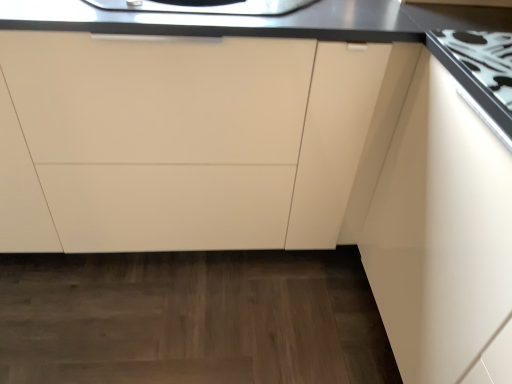
What do you see at coordinates (205, 137) in the screenshot?
I see `matte white cabinet at center` at bounding box center [205, 137].

Where is `matte white cabinet at center`? This screenshot has height=384, width=512. matte white cabinet at center is located at coordinates pyautogui.click(x=205, y=137).

Locate an element on the screen. white glossy gas stove at upper right is located at coordinates (482, 58).

What do you see at coordinates (482, 58) in the screenshot?
I see `white glossy gas stove at upper right` at bounding box center [482, 58].

Measure the distance between white glossy gas stove at upper right and camera.

The depth of white glossy gas stove at upper right is 31.69 inches.

Identify the location of matte white cabinet at center. (205, 137).

Would you say white glossy gas stove at upper right is to the left or to the right of matte white cabinet at center in the picture?

Based on their positions, white glossy gas stove at upper right is located to the right of matte white cabinet at center.

Is white glossy gas stove at upper right in front of or behind matte white cabinet at center in the image?

In the image, white glossy gas stove at upper right appears in front of matte white cabinet at center.

Which point is more forward, (509, 54) or (353, 96)?

The point (509, 54) is in front.

From the image's perspective, is white glossy gas stove at upper right on top of matte white cabinet at center?

Yes, from the image's perspective, white glossy gas stove at upper right is on top of matte white cabinet at center.

From a real-world perspective, is white glossy gas stove at upper right positioned under matte white cabinet at center based on gravity?

No, from a real-world perspective, white glossy gas stove at upper right is not beneath matte white cabinet at center.

Which of these two, white glossy gas stove at upper right or matte white cabinet at center, is wider?

Wider between the two is matte white cabinet at center.

In the scene shown: Can you confirm if white glossy gas stove at upper right is shorter than matte white cabinet at center?

Correct, white glossy gas stove at upper right is not as tall as matte white cabinet at center.

Consider the image. Can you confirm if white glossy gas stove at upper right is smaller than matte white cabinet at center?

Indeed, white glossy gas stove at upper right has a smaller size compared to matte white cabinet at center.

Is matte white cabinet at center inside white glossy gas stove at upper right?

No, white glossy gas stove at upper right does not contain matte white cabinet at center.

Would you say white glossy gas stove at upper right is a long distance from matte white cabinet at center?

No, white glossy gas stove at upper right is not far from matte white cabinet at center.

Is white glossy gas stove at upper right oriented towards matte white cabinet at center?

No, white glossy gas stove at upper right is not aimed at matte white cabinet at center.

I want to click on gas stove located in front of the matte white cabinet at center, so click(482, 58).

Considering the positions of objects matte white cabinet at center and white glossy gas stove at upper right in the image provided, who is more to the left, matte white cabinet at center or white glossy gas stove at upper right?

Positioned to the left is matte white cabinet at center.

Which object is closer to the camera taking this photo, matte white cabinet at center or white glossy gas stove at upper right?

white glossy gas stove at upper right.

Between point (19, 229) and point (511, 53), which one is positioned in front?

Point (511, 53)

Based on the photo, from the image's perspective, between matte white cabinet at center and white glossy gas stove at upper right, who is located below?

matte white cabinet at center.

From a real-world perspective, relative to white glossy gas stove at upper right, is matte white cabinet at center vertically above or below?

Clearly, from a real-world perspective, matte white cabinet at center is below white glossy gas stove at upper right.

In the scene shown: Considering the sizes of objects matte white cabinet at center and white glossy gas stove at upper right in the image provided, who is wider, matte white cabinet at center or white glossy gas stove at upper right?

matte white cabinet at center.

Between matte white cabinet at center and white glossy gas stove at upper right, which one has less height?

white glossy gas stove at upper right.

Who is bigger, matte white cabinet at center or white glossy gas stove at upper right?

With larger size is matte white cabinet at center.

Is matte white cabinet at center outside of white glossy gas stove at upper right?

matte white cabinet at center lies outside white glossy gas stove at upper right's area.

Would you consider matte white cabinet at center to be distant from white glossy gas stove at upper right?

matte white cabinet at center is near white glossy gas stove at upper right, not far away.

Is matte white cabinet at center facing away from white glossy gas stove at upper right?

No, matte white cabinet at center is not facing away from white glossy gas stove at upper right.

Measure the distance between matte white cabinet at center and white glossy gas stove at upper right.

23.91 inches.

Where is `gas stove located above the matte white cabinet at center (from a real-world perspective)`? The image size is (512, 384). gas stove located above the matte white cabinet at center (from a real-world perspective) is located at coordinates (482, 58).

The image size is (512, 384). Find the location of `cabinetry lying on the left of white glossy gas stove at upper right`. cabinetry lying on the left of white glossy gas stove at upper right is located at coordinates (205, 137).

Where is `cabinetry that is under the white glossy gas stove at upper right (from a real-world perspective)`? The image size is (512, 384). cabinetry that is under the white glossy gas stove at upper right (from a real-world perspective) is located at coordinates (205, 137).